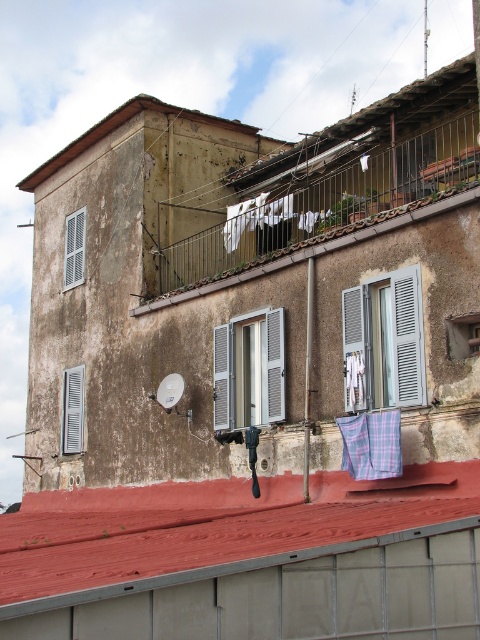
You are standing in front of the old building and want to hang a new clothesline. The clothesline needs to be placed above the white matte shutter at left but below the rusty metal railing at upper center. Is this possible?

The rusty metal railing at upper center is taller than the white matte shutter at left, so there is space between them. Therefore, you can place the clothesline above the white matte shutter at left and below the rusty metal railing at upper center.

You are a painter standing on the ground floor of the building. You need to paint both the weathered concrete roof at upper center and the white wooden shutters at left. Which one will require you to reach higher?

The weathered concrete roof at upper center requires reaching higher since it has a greater height compared to the white wooden shutters at left.